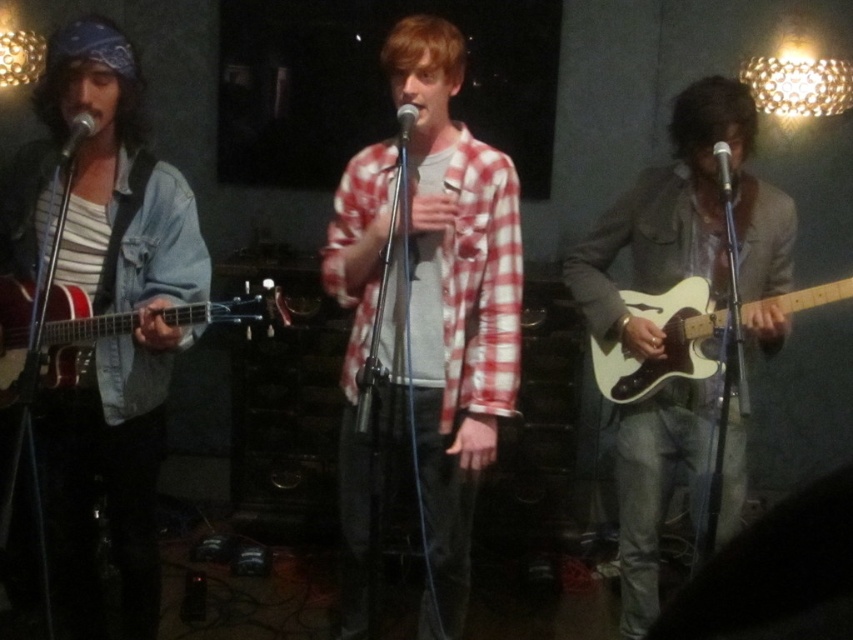
Is the position of matte black microphone at left less distant than that of matte black microphone at center?

Yes, it is.

Which is above, matte black microphone at left or matte black microphone at center?

matte black microphone at center

Between point (64, 148) and point (413, 125), which one is positioned in front?

Point (64, 148) is more forward.

You are a GUI agent. You are given a task and a screenshot of the screen. Output one action in this format:
    pyautogui.click(x=<x>, y=<y>)
    Task: Click on the matte black microphone at left
    The image size is (853, 640).
    Given the screenshot: What is the action you would take?
    pyautogui.click(x=77, y=132)

How far apart are checkered fabric shirt at center and matte black microphone at left?

36.97 inches

Consider the image. Who is higher up, checkered fabric shirt at center or matte black microphone at left?

matte black microphone at left

The width and height of the screenshot is (853, 640). I want to click on checkered fabric shirt at center, so click(450, 307).

Is point (775, 301) farther from viewer compared to point (717, 145)?

Yes, point (775, 301) is behind point (717, 145).

Can you confirm if white matte electric guitar at right is bigger than metallic silver microphone at center?

Yes, white matte electric guitar at right is bigger than metallic silver microphone at center.

Locate an element on the screen. The image size is (853, 640). white matte electric guitar at right is located at coordinates (688, 333).

Identify the location of white matte electric guitar at right. This screenshot has width=853, height=640. (688, 333).